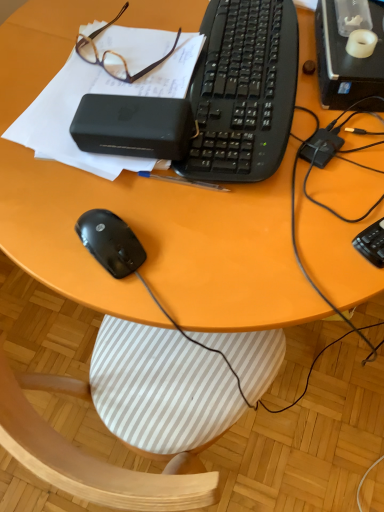
Locate an element on the screen. This screenshot has height=512, width=384. free region on the left part of black plastic keyboard at center, positioned as the 2th computer keyboard in front-to-back order is located at coordinates (39, 90).